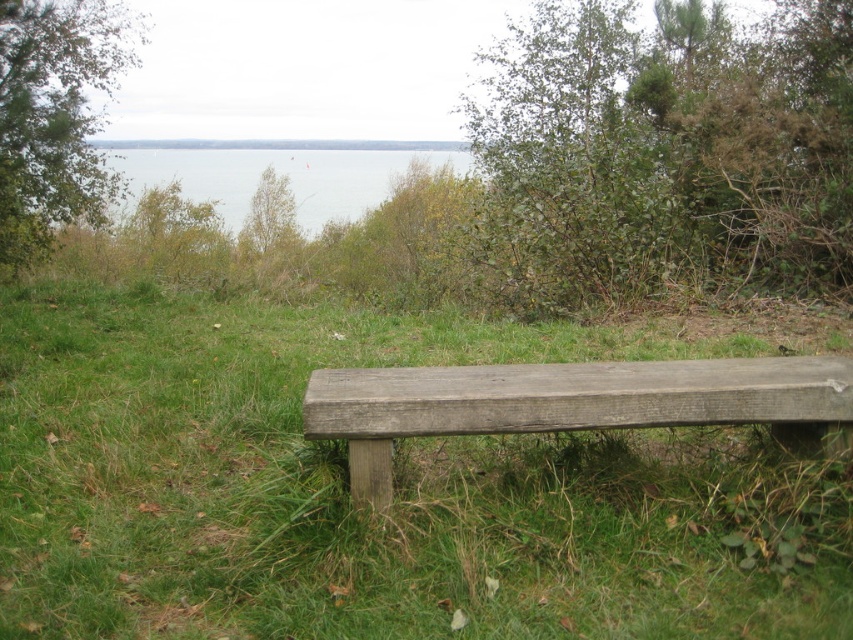
Does weathered wood bench at lower center have a greater height compared to green leafy tree at upper left?

Indeed, weathered wood bench at lower center has a greater height compared to green leafy tree at upper left.

Does weathered wood bench at lower center lie behind green leafy tree at upper left?

No, it is not.

The image size is (853, 640). What are the coordinates of `weathered wood bench at lower center` in the screenshot? It's located at (567, 403).

In order to click on weathered wood bench at lower center in this screenshot , I will do `click(567, 403)`.

Who is higher up, green leafy bush at upper right or blue water at upper center?

green leafy bush at upper right is higher up.

The image size is (853, 640). What do you see at coordinates (665, 152) in the screenshot?
I see `green leafy bush at upper right` at bounding box center [665, 152].

The height and width of the screenshot is (640, 853). I want to click on green leafy bush at upper right, so click(x=665, y=152).

Which is above, green rough wood bench at center or green leafy tree at upper left?

green leafy tree at upper left

Can you confirm if green rough wood bench at center is wider than green leafy tree at upper left?

Yes, green rough wood bench at center is wider than green leafy tree at upper left.

You are a GUI agent. You are given a task and a screenshot of the screen. Output one action in this format:
    pyautogui.click(x=<x>, y=<y>)
    Task: Click on the green rough wood bench at center
    Image resolution: width=853 pixels, height=640 pixels.
    Given the screenshot: What is the action you would take?
    pyautogui.click(x=393, y=484)